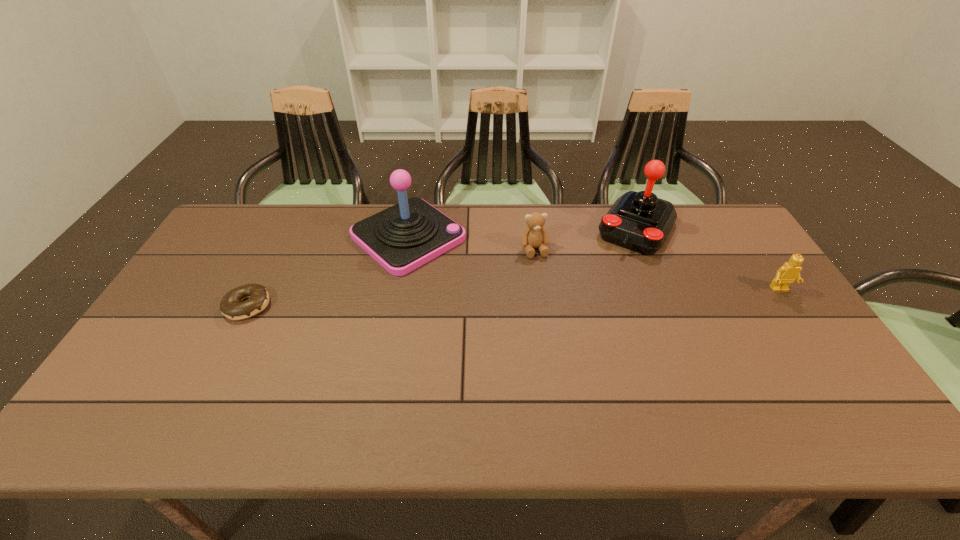
Find the location of a particular element. the shortest object is located at coordinates (231, 306).

You are a GUI agent. You are given a task and a screenshot of the screen. Output one action in this format:
    pyautogui.click(x=<x>, y=<y>)
    Task: Click on the doughnut
    Image resolution: width=960 pixels, height=540 pixels.
    Given the screenshot: What is the action you would take?
    pyautogui.click(x=231, y=306)

Where is `the rightmost object`? The height and width of the screenshot is (540, 960). the rightmost object is located at coordinates (790, 271).

Where is `teddy bear`? The height and width of the screenshot is (540, 960). teddy bear is located at coordinates (534, 236).

This screenshot has height=540, width=960. I want to click on the left joystick, so click(403, 237).

At what (x,y) coordinates should I click in order to perform the action: click on the fourth object from left to right. Please return your answer as a coordinate pair (x, y). The image size is (960, 540). Looking at the image, I should click on (639, 221).

Identify the location of vacant space situated on the back of the doughnut. (272, 260).

The width and height of the screenshot is (960, 540). What are the coordinates of `free spot located on the face of the rightmost object` in the screenshot? It's located at (827, 358).

This screenshot has height=540, width=960. Identify the location of vacant space situated 0.150m on the face of the third object from right to left. click(549, 294).

You are a GUI agent. You are given a task and a screenshot of the screen. Output one action in this format:
    pyautogui.click(x=<x>, y=<y>)
    Task: Click on the free region located 0.130m on the face of the third object from right to left
    This screenshot has width=960, height=540.
    Given the screenshot: What is the action you would take?
    547,289